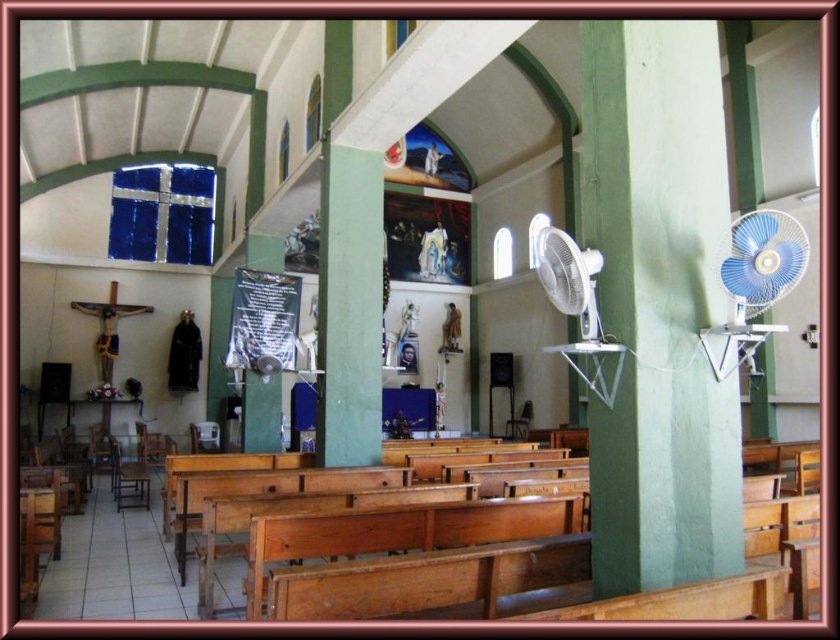
You are planning to place a small plant pot between the green matte pillar at right and the wooden bench at center. Since the pillar is smaller, will there be enough space for the plant pot?

The green matte pillar at right occupies less space than wooden bench at center, so there should be enough space between them to place the small plant pot.

You are standing at the entrance of the church and want to sit down. The wooden bench at center is your only option. Can you walk straight ahead from your current position to reach it?

The wooden bench at center is located at point (428, 561), which means it is positioned to the right and slightly forward from the entrance. Since you are at the entrance, walking straight ahead might not directly lead you to the bench. You may need to adjust your path to the right to reach it.